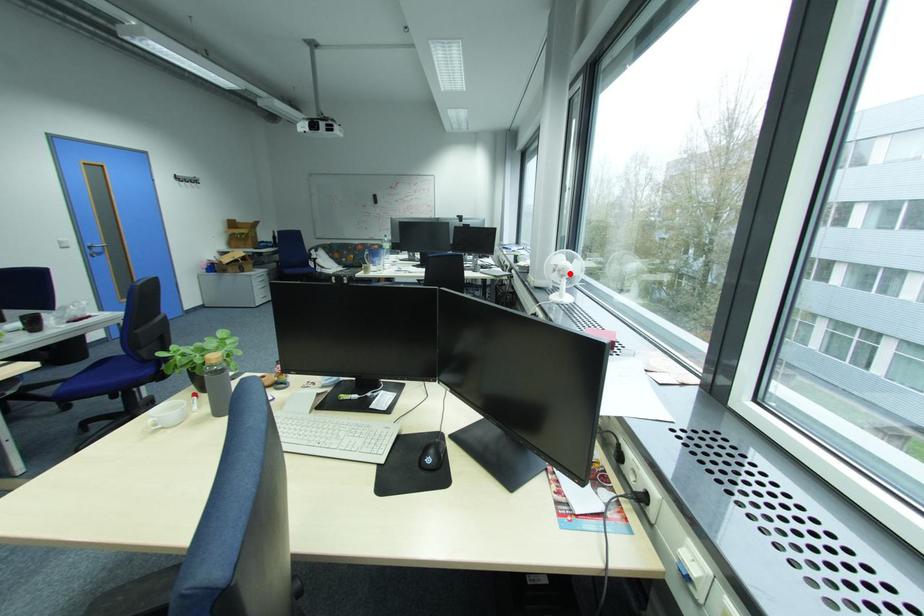
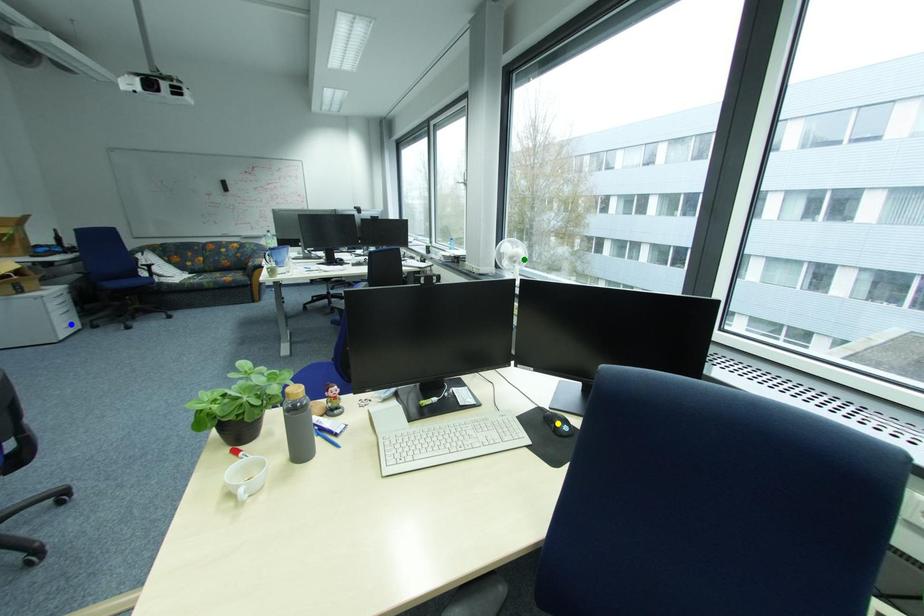
Question: I am providing you with two images of the same scene from different viewpoints. A red point is marked on the first image. You are given multiple points on the second image. Which mark in image 2 goes with the point in image 1?

Choices:
 (A) yellow point
 (B) blue point
 (C) green point

Answer: (C)